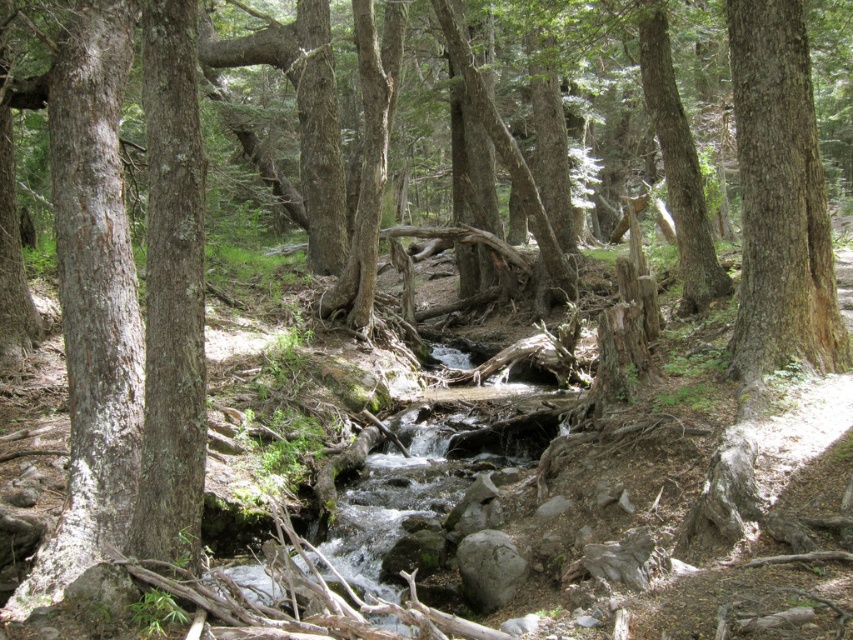
Is smooth bark tree at center bigger than gray rough rock at center?

Yes.

Does smooth bark tree at center have a smaller size compared to gray rough rock at center?

Actually, smooth bark tree at center might be larger than gray rough rock at center.

Image resolution: width=853 pixels, height=640 pixels. I want to click on smooth bark tree at center, so click(x=780, y=198).

The image size is (853, 640). I want to click on smooth bark tree at center, so click(x=780, y=198).